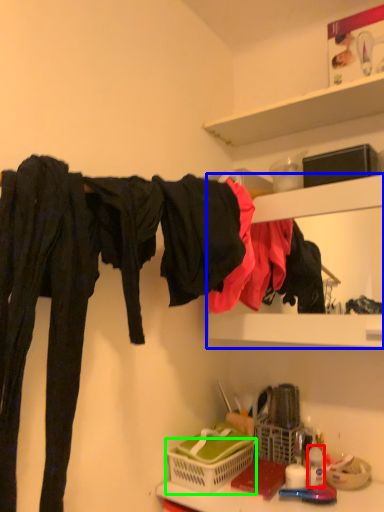
Question: Which object is positioned farthest from toiletry (highlighted by a red box)? Select from cabinet (highlighted by a blue box) and basket (highlighted by a green box).

Choices:
 (A) cabinet
 (B) basket

Answer: (A)